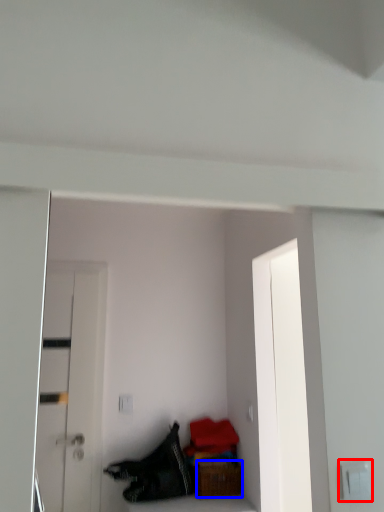
Question: Which of the following is the farthest to the observer, electric outlet (highlighted by a red box) or furniture (highlighted by a blue box)?

Choices:
 (A) electric outlet
 (B) furniture

Answer: (B)